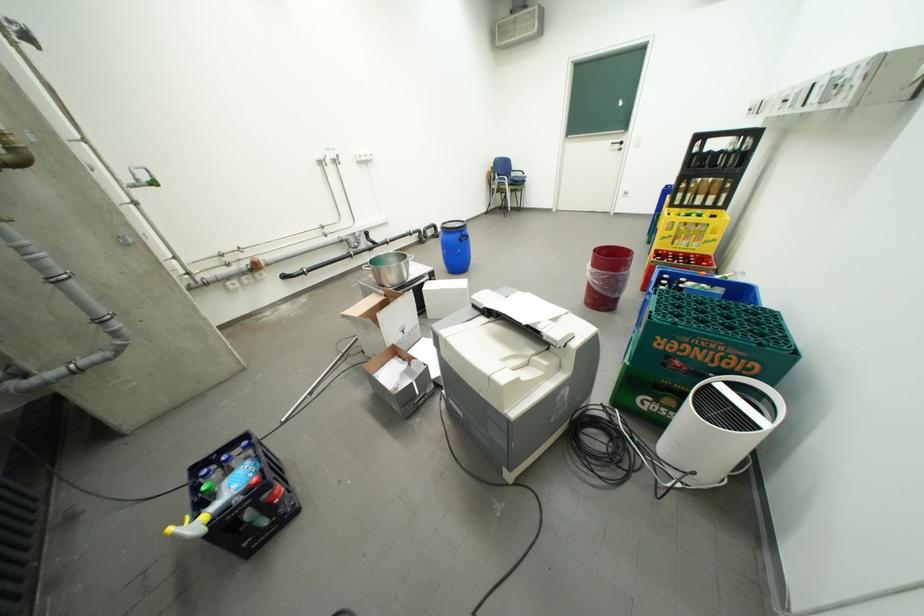
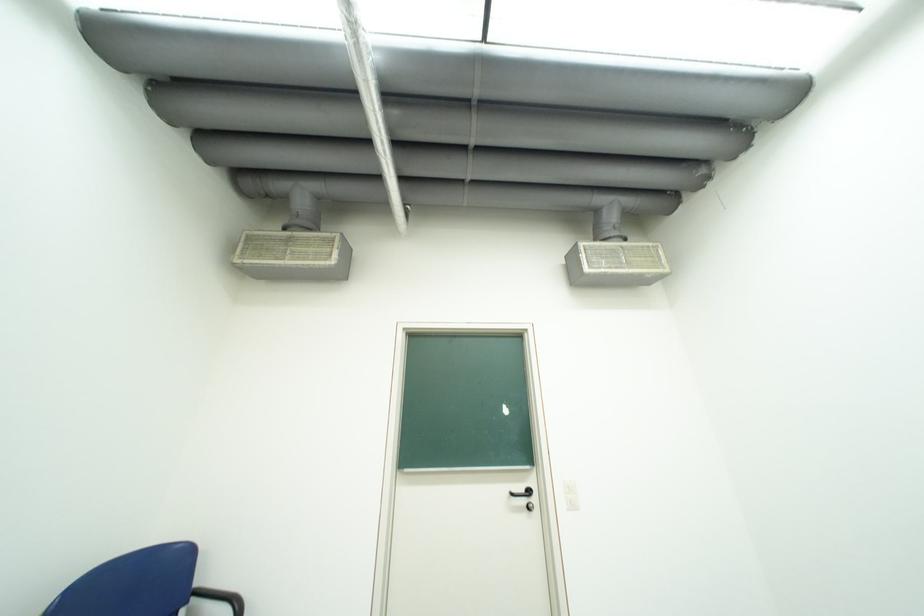
Locate, in the second image, the point that corresponds to (x=623, y=145) in the first image.

(523, 495)